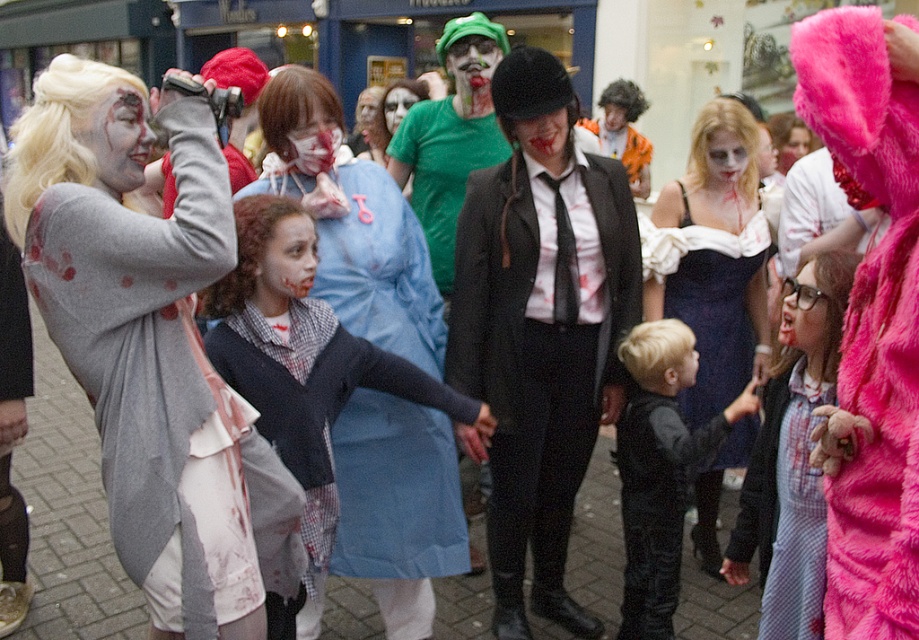
Question: Considering the relative positions of green matte shirt at center and dark brown curly wig at center in the image provided, where is green matte shirt at center located with respect to dark brown curly wig at center?

Choices:
 (A) above
 (B) below

Answer: (A)

Question: Which of the following is the farthest from the observer?

Choices:
 (A) (728, 308)
 (B) (727, 104)
 (C) (519, 538)

Answer: (A)

Question: Where is matte gray sweater at left located in relation to blonde synthetic wig at upper center in the image?

Choices:
 (A) above
 (B) below

Answer: (B)

Question: Does matte black suit at center have a lesser width compared to blonde hair at center?

Choices:
 (A) no
 (B) yes

Answer: (A)

Question: Based on their relative distances, which object is nearer to the blonde synthetic wig at center?

Choices:
 (A) light blue checkered dress at lower right
 (B) blonde synthetic wig at upper left

Answer: (B)

Question: Which of the following is the farthest from the observer?

Choices:
 (A) (216, 294)
 (B) (305, 112)
 (C) (511, 241)

Answer: (C)